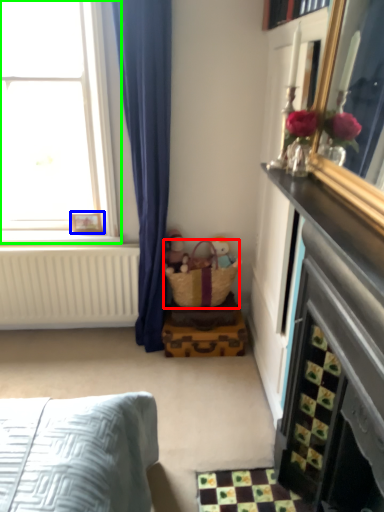
Question: Estimate the real-world distances between objects in this image. Which object is farther from basket (highlighted by a red box), picture frame (highlighted by a blue box) or window (highlighted by a green box)?

Choices:
 (A) picture frame
 (B) window

Answer: (B)